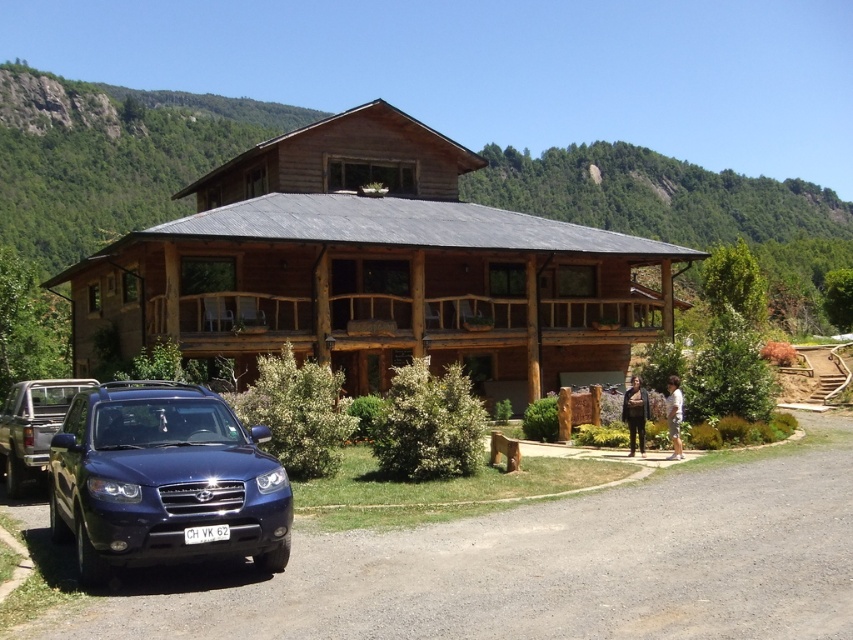
You are standing in the middle of the smooth asphalt driveway at lower left and want to walk to the brown wooden cabin at center. Which direction should you head to get closer to the cabin?

You should head towards the brown wooden cabin at center, as it is further away from your current position on the smooth asphalt driveway at lower left.

You are a delivery person arriving at this house. You need to park your vehicle on the smooth asphalt driveway at lower left and then walk to the brown wooden porch at center. Is the driveway long enough for your vehicle to turn around without needing to back up?

The smooth asphalt driveway at lower left is shorter than the brown wooden porch at center. However, the description does not provide specific measurements about the driveway length relative to the vehicle size, so it is unclear if it is long enough for a vehicle to turn around without backing up.

You are standing at the entrance of the property and want to find the brown wooden cabin at center. Based on the coordinates provided, can you determine its position relative to your current location?

The brown wooden cabin at center is located at coordinates point [374,269], which is slightly to the right and forward from the entrance, so you should move towards that direction to reach it.